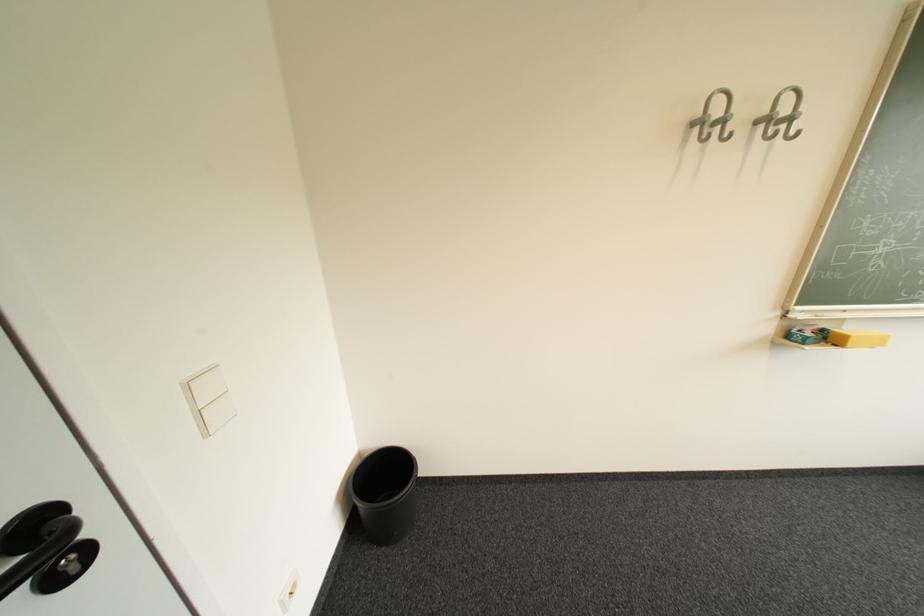
The height and width of the screenshot is (616, 924). What do you see at coordinates (287, 591) in the screenshot?
I see `the power outlet` at bounding box center [287, 591].